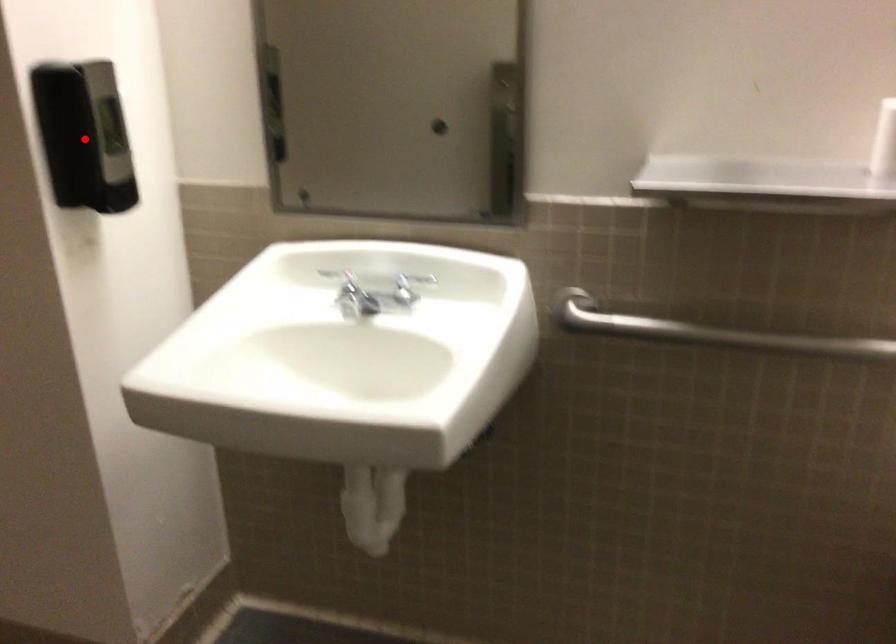
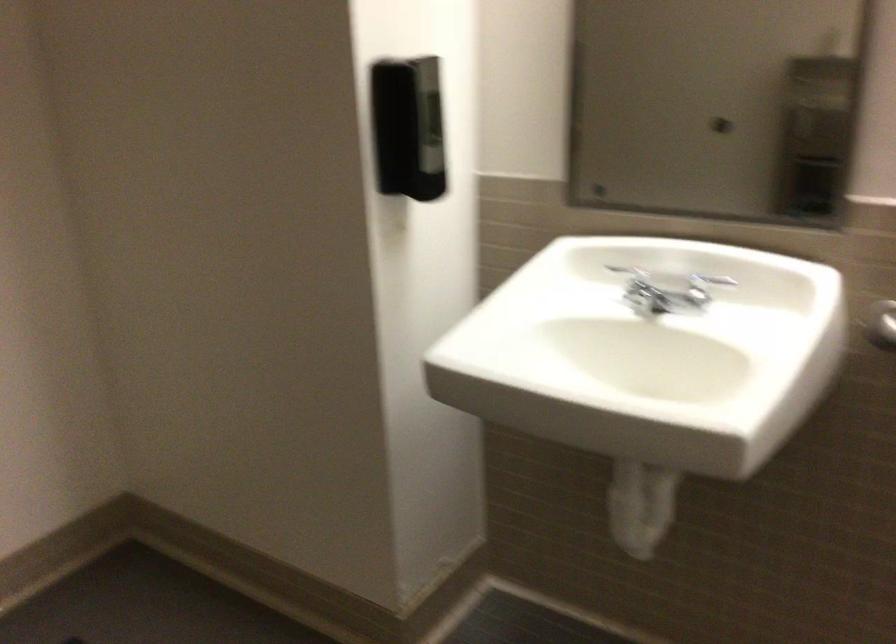
Where in the second image is the point corresponding to the highlighted location from the first image?

(408, 128)